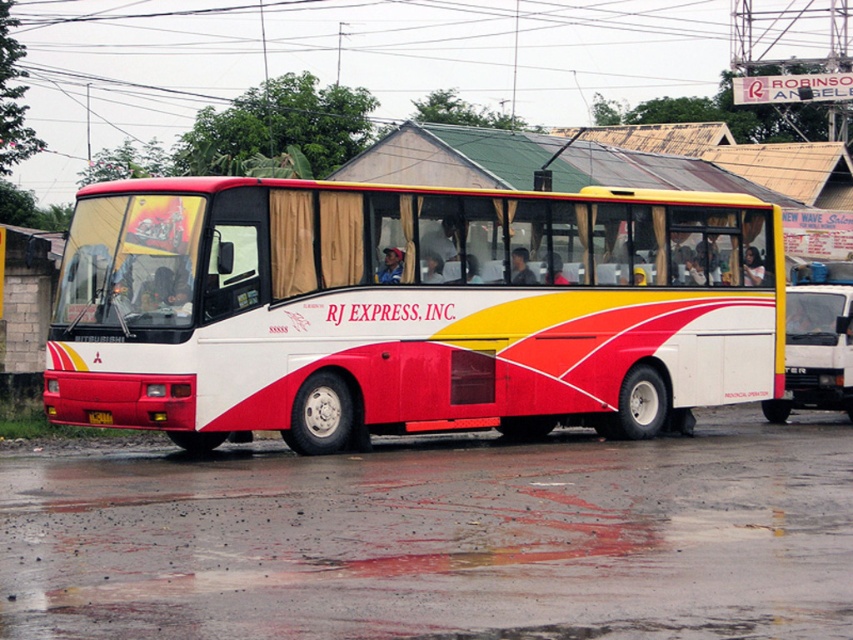
Question: Estimate the real-world distances between objects in this image. Which object is farther from the white matte bus at center?

Choices:
 (A) white glossy tour bus at right
 (B) yellow matte license plate at center

Answer: (A)

Question: Can you confirm if white glossy tour bus at right is positioned above yellow matte license plate at center?

Choices:
 (A) yes
 (B) no

Answer: (A)

Question: Does white glossy tour bus at right have a greater width compared to yellow matte license plate at center?

Choices:
 (A) no
 (B) yes

Answer: (B)

Question: Which object is closer to the camera taking this photo?

Choices:
 (A) yellow matte license plate at center
 (B) white matte bus at center

Answer: (B)

Question: Which point appears farthest from the camera in this image?

Choices:
 (A) (577, 193)
 (B) (97, 424)
 (C) (828, 387)

Answer: (C)

Question: Does white matte bus at center have a greater width compared to yellow matte license plate at center?

Choices:
 (A) no
 (B) yes

Answer: (B)